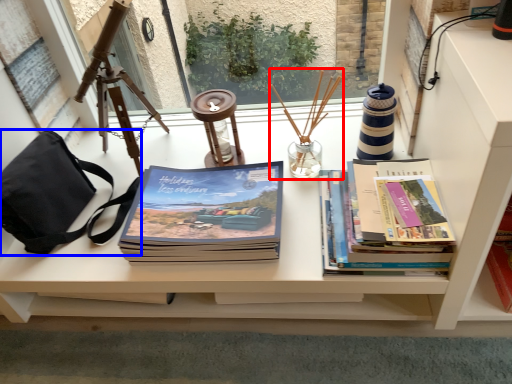
Question: Which object appears farthest to the camera in this image, candle holder (highlighted by a red box) or handbag (highlighted by a blue box)?

Choices:
 (A) candle holder
 (B) handbag

Answer: (A)